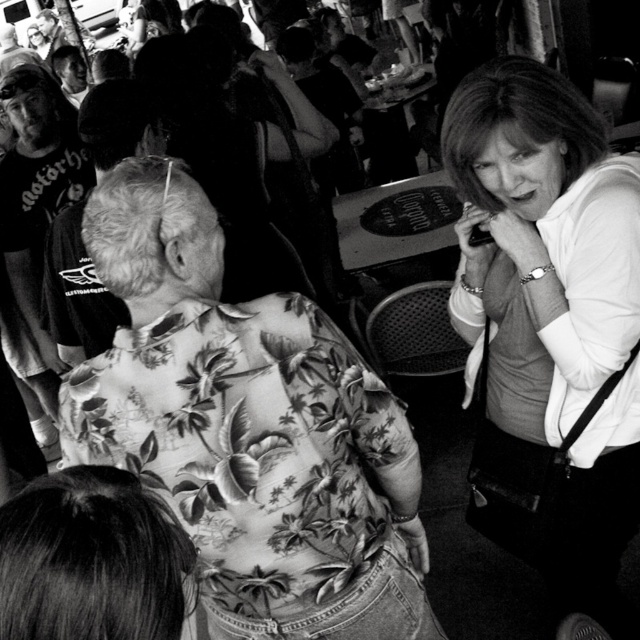
You are standing at the center of the image. There is a point at coordinate (548, 324). What object is located at that point?

The point at coordinate (548, 324) has a matte white shirt at right.